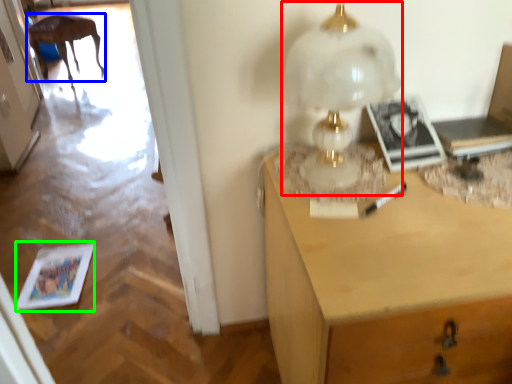
Question: Which object is the closest to the table lamp (highlighted by a red box)? Choose among these: furniture (highlighted by a blue box) or magazine (highlighted by a green box).

Choices:
 (A) furniture
 (B) magazine

Answer: (B)